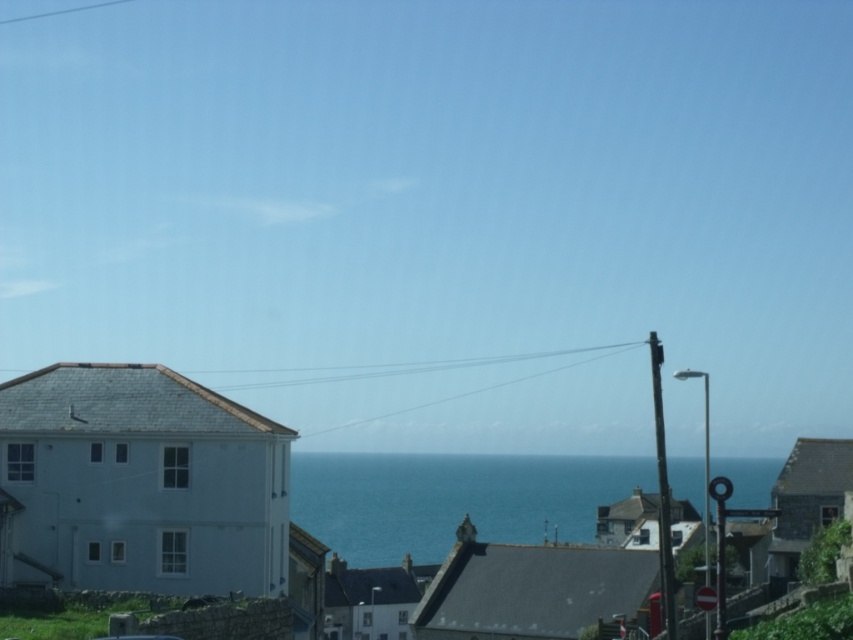
Between point (646, 483) and point (392, 563), which one is positioned behind?

Positioned behind is point (646, 483).

Is white matte building at lower left to the right of blue water at center from the viewer's perspective?

Incorrect, white matte building at lower left is not on the right side of blue water at center.

Between point (119, 464) and point (498, 492), which one is positioned behind?

The point (498, 492) is behind.

Where is `white matte building at lower left`? The width and height of the screenshot is (853, 640). white matte building at lower left is located at coordinates (242, 484).